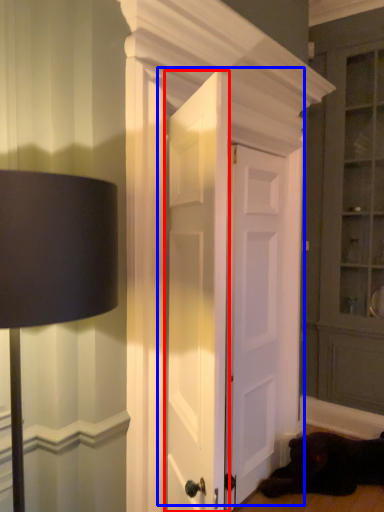
Question: Which of the following is the farthest to the observer, door (highlighted by a red box) or door (highlighted by a blue box)?

Choices:
 (A) door
 (B) door

Answer: (B)